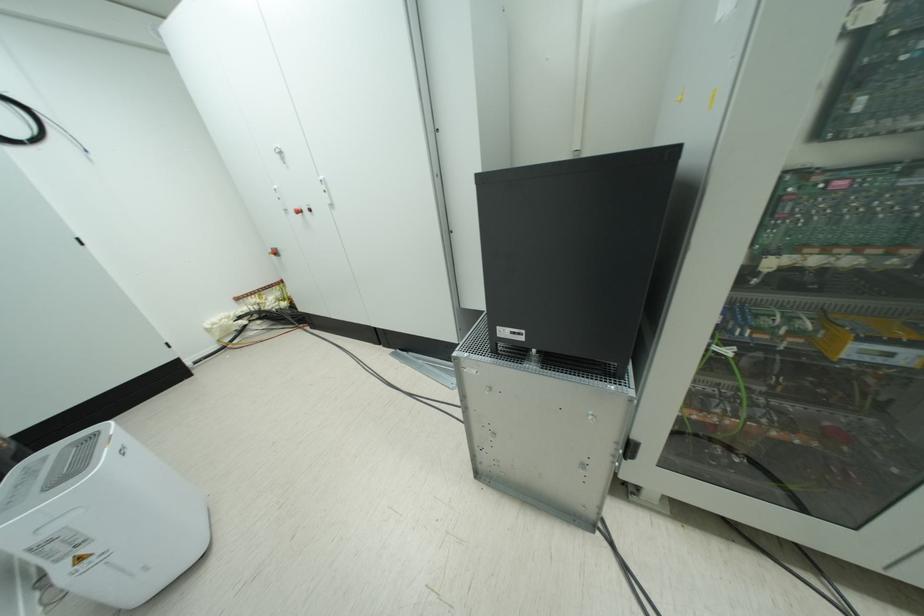
The image size is (924, 616). Describe the element at coordinates (280, 155) in the screenshot. I see `the white cabinet handle` at that location.